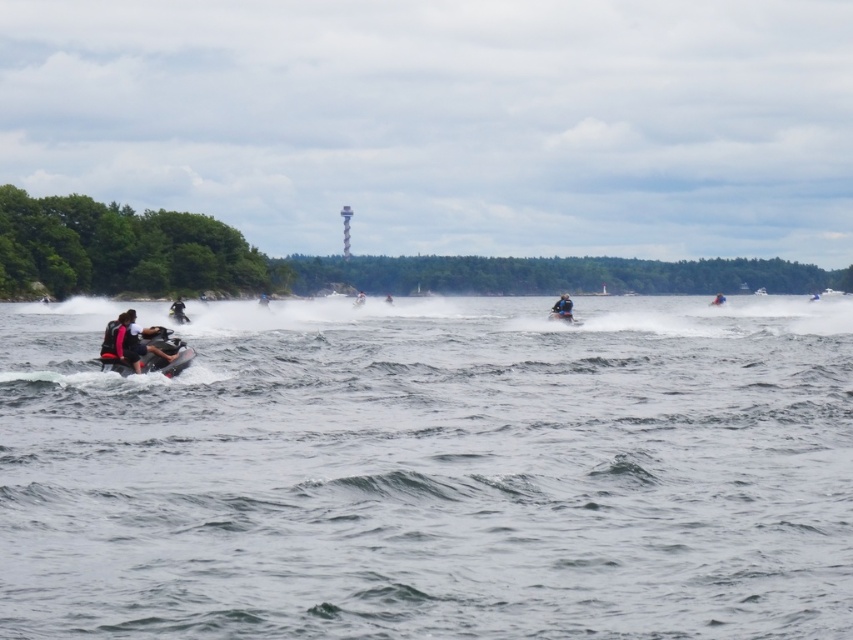
Question: Does matte black jet ski at left have a smaller size compared to black rubber jet ski at left?

Choices:
 (A) no
 (B) yes

Answer: (B)

Question: Estimate the real-world distances between objects in this image. Which object is farther from the yellow foam at center?

Choices:
 (A) smooth black jet ski at center
 (B) white plastic jet ski at center
 (C) black rubber jet ski at left
 (D) blue rubber jet ski at center

Answer: (C)

Question: In this image, where is black matte jet ski at lower left located relative to matte black jet ski at left?

Choices:
 (A) left
 (B) right

Answer: (B)

Question: From the image, what is the correct spatial relationship of black matte jet ski at lower left in relation to blue rubber jet ski at center?

Choices:
 (A) left
 (B) right

Answer: (A)

Question: Which object is the closest to the smooth black jet ski at center?

Choices:
 (A) black matte jet ski at lower left
 (B) yellow foam at center

Answer: (B)

Question: Which point appears farthest from the camera in this image?

Choices:
 (A) tap(578, 323)
 (B) tap(718, 301)
 (C) tap(126, 360)

Answer: (B)